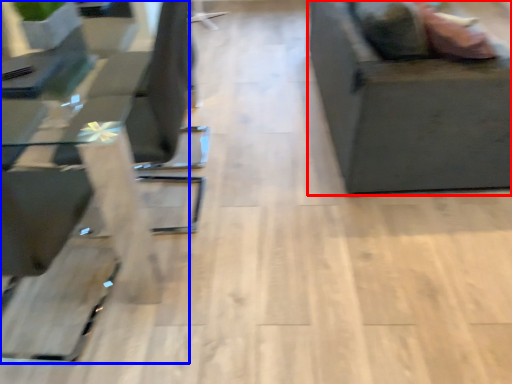
Question: Which point is closer to the camera, furniture (highlighted by a red box) or table (highlighted by a blue box)?

Choices:
 (A) furniture
 (B) table

Answer: (B)